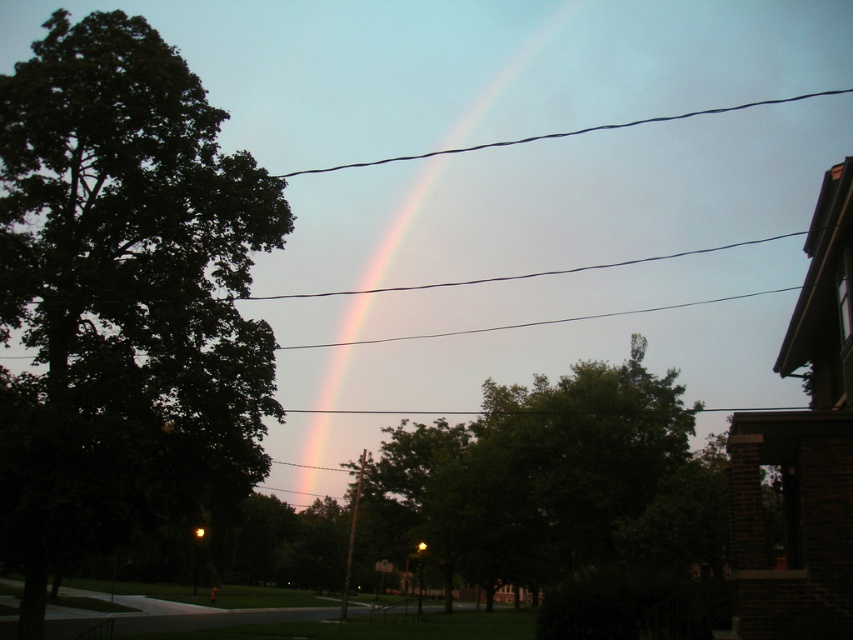
Question: Estimate the real-world distances between objects in this image. Which object is closer to the green leafy tree at left?

Choices:
 (A) black wire at upper center
 (B) rainbow at center

Answer: (B)

Question: Is rainbow at center in front of black wire at upper center?

Choices:
 (A) yes
 (B) no

Answer: (A)

Question: Which point is farther to the camera?

Choices:
 (A) green leafy tree at left
 (B) black wire at upper center
 (C) rainbow at center

Answer: (B)

Question: Can you confirm if rainbow at center is wider than black wire at upper center?

Choices:
 (A) yes
 (B) no

Answer: (B)

Question: Considering the real-world distances, which object is closest to the rainbow at center?

Choices:
 (A) green leafy tree at left
 (B) black wire at upper center

Answer: (B)

Question: Is rainbow at center positioned before black wire at upper center?

Choices:
 (A) yes
 (B) no

Answer: (A)